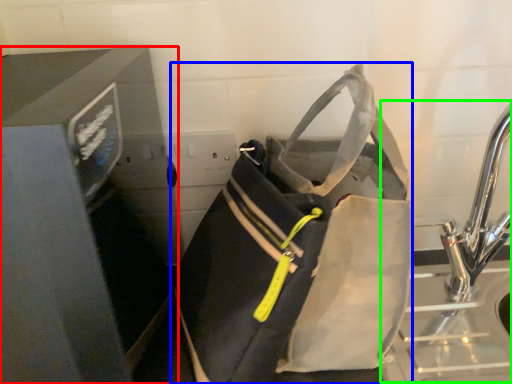
Question: Which object is the closest to the appliance (highlighted by a red box)? Choose among these: luggage and bags (highlighted by a blue box) or sink (highlighted by a green box).

Choices:
 (A) luggage and bags
 (B) sink

Answer: (A)